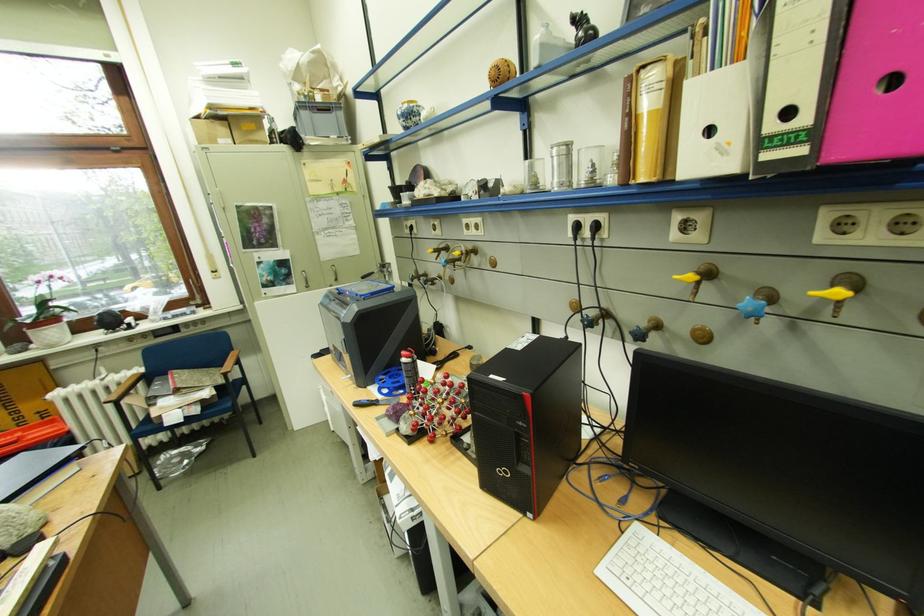
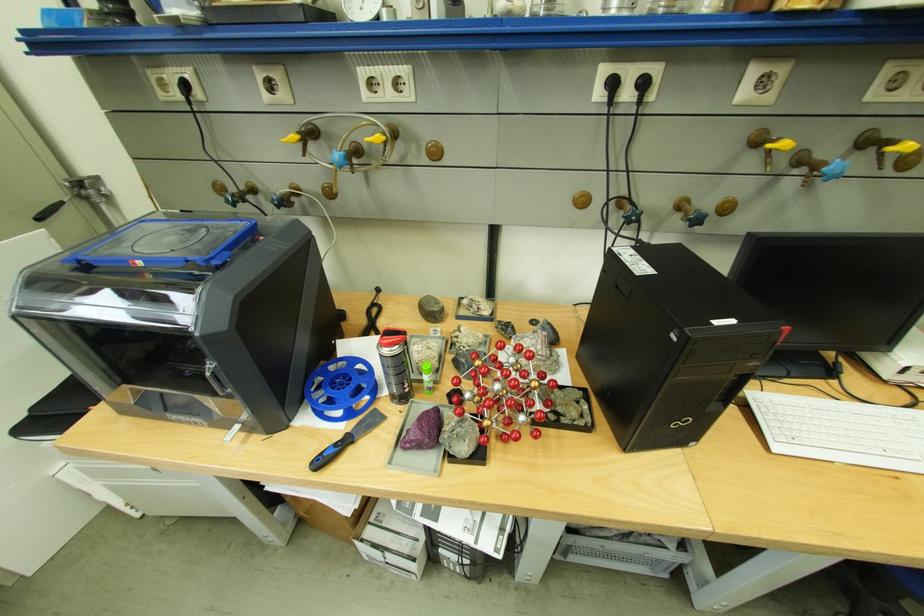
Locate, in the second image, the point that corresponds to (x=415, y=429) in the first image.

(475, 448)